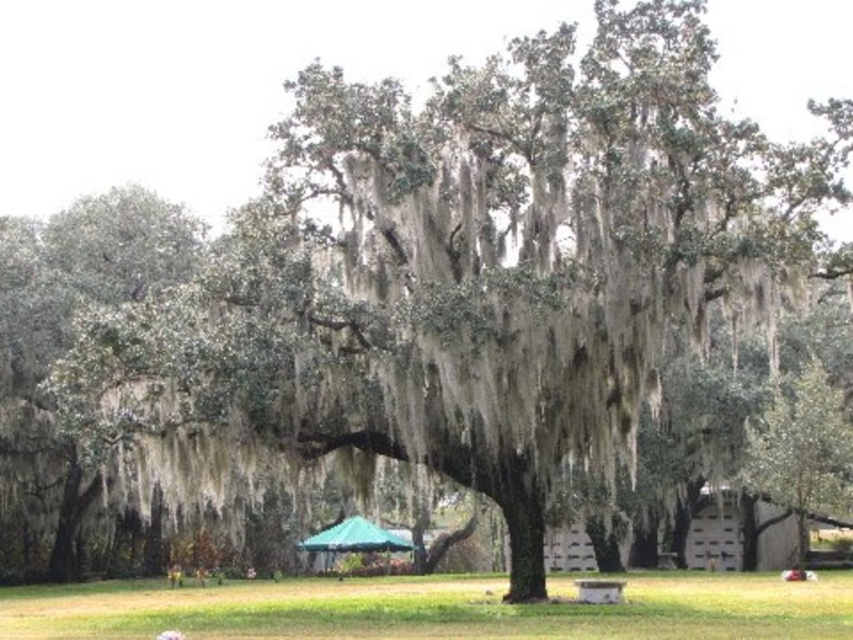
You are planning to take a nap in the park. The green mossy tree at center provides shade, and there is a wooden park bench at center nearby. Which object would you choose to rest under to stay cool, and why?

The green mossy tree at center is larger than the wooden park bench at center, so it provides a bigger shaded area. Therefore, resting under the green mossy tree at center would keep you cooler.

You are sitting on the wooden park bench at center and want to know if the green fabric canopy at center is above or below you. Based on the scene description, what is the relationship between the two?

The green fabric canopy at center is positioned under the wooden park bench at center, so it is below you.